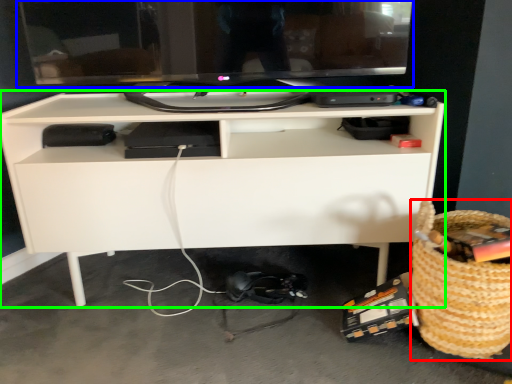
Question: Considering the real-world distances, which object is farthest from basket (highlighted by a red box)? computer monitor (highlighted by a blue box) or desk (highlighted by a green box)?

Choices:
 (A) computer monitor
 (B) desk

Answer: (A)